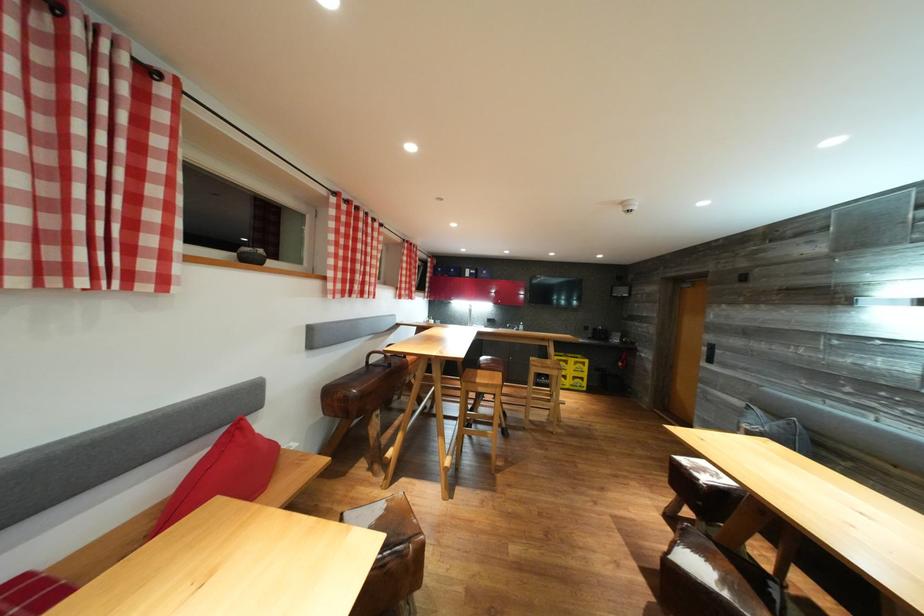
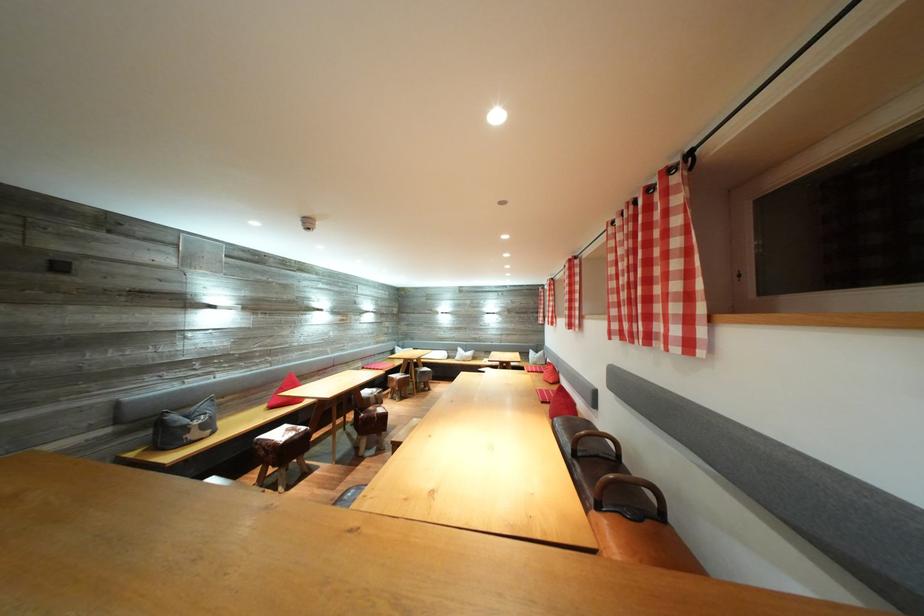
Question: I am providing you with two images of the same scene from different viewpoints. Please identify which objects are invisible in image2.

Choices:
 (A) sofa sitting surface
 (B) pink flip-flop
 (C) red checkered curtain
 (D) chair sitting surface

Answer: (C)